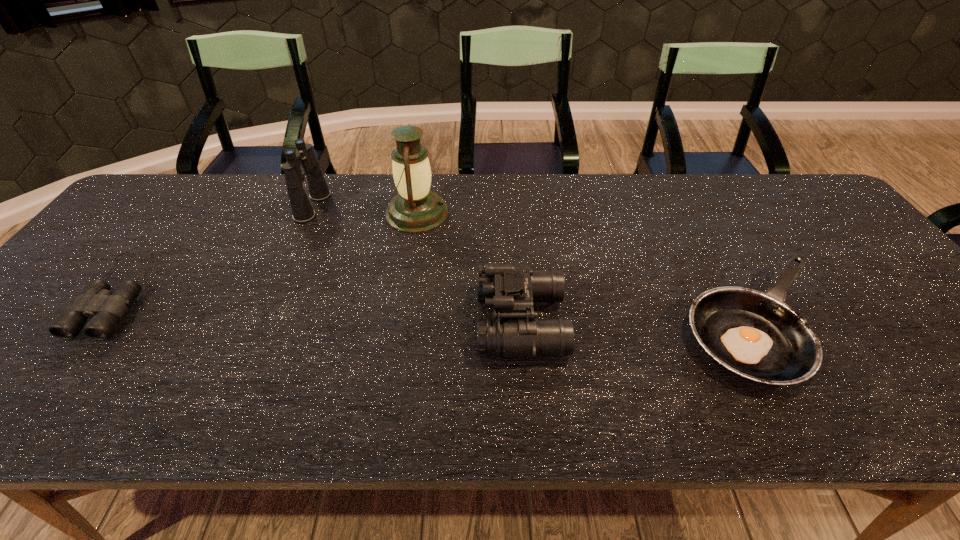
The image size is (960, 540). In order to click on lantern in this screenshot , I will do pyautogui.click(x=415, y=209).

Where is `the tallest object`? This screenshot has height=540, width=960. the tallest object is located at coordinates (415, 209).

The height and width of the screenshot is (540, 960). I want to click on the tallest binoculars, so click(x=302, y=210).

Image resolution: width=960 pixels, height=540 pixels. I want to click on the second binoculars from left to right, so click(x=302, y=210).

The height and width of the screenshot is (540, 960). I want to click on the fourth object from left to right, so click(x=511, y=290).

The height and width of the screenshot is (540, 960). I want to click on the rightmost binoculars, so click(x=511, y=290).

Where is `the leftmost binoculars`? This screenshot has width=960, height=540. the leftmost binoculars is located at coordinates (96, 301).

I want to click on the leftmost object, so click(96, 301).

Identify the location of the rightmost object. (755, 335).

Find the location of a particular element. The width and height of the screenshot is (960, 540). vacant region located with the light compartment facing forward on the third object from right to left is located at coordinates (513, 213).